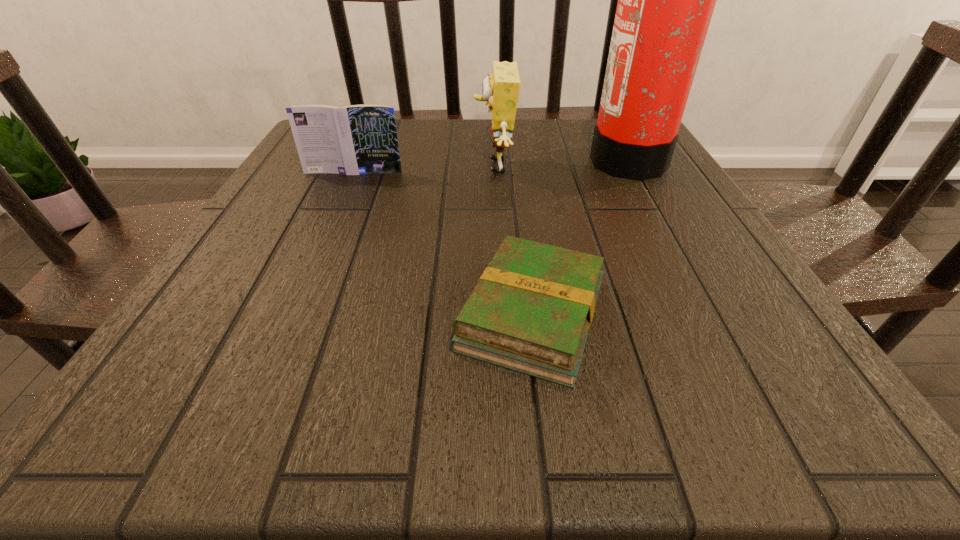
The height and width of the screenshot is (540, 960). What are the coordinates of `blank space located 0.310m on the face of the sponge` in the screenshot? It's located at (336, 167).

You are a GUI agent. You are given a task and a screenshot of the screen. Output one action in this format:
    pyautogui.click(x=<x>, y=<y>)
    Task: Click on the free space located on the face of the sponge
    The height and width of the screenshot is (540, 960).
    Given the screenshot: What is the action you would take?
    pyautogui.click(x=341, y=167)

Where is `vacant space located 0.310m on the face of the sponge`? vacant space located 0.310m on the face of the sponge is located at coordinates (336, 167).

Locate an element on the screen. This screenshot has height=540, width=960. free space located 0.140m on the front cover of the second shortest object is located at coordinates (337, 210).

The image size is (960, 540). I want to click on free point located 0.190m on the right of the nearest object, so click(741, 315).

I want to click on fire extinguisher located in the far edge section of the desktop, so click(666, 0).

I want to click on sponge located in the far edge section of the desktop, so click(x=501, y=89).

Find the location of `object located at the near edge`. object located at the near edge is located at coordinates (531, 311).

The width and height of the screenshot is (960, 540). Find the location of `object that is at the left edge`. object that is at the left edge is located at coordinates (358, 139).

I want to click on object located at the right edge, so point(666,0).